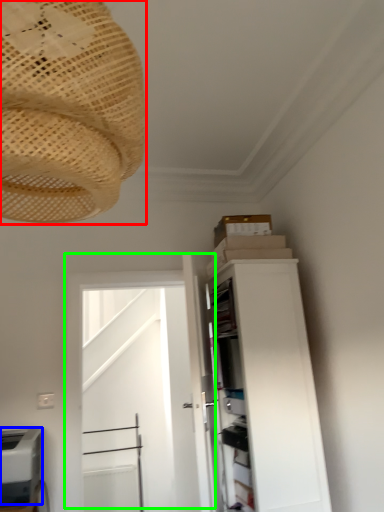
Question: Which is nearer to the lamp (highlighted by a red box)? appliance (highlighted by a blue box) or door (highlighted by a green box).

Choices:
 (A) appliance
 (B) door

Answer: (A)